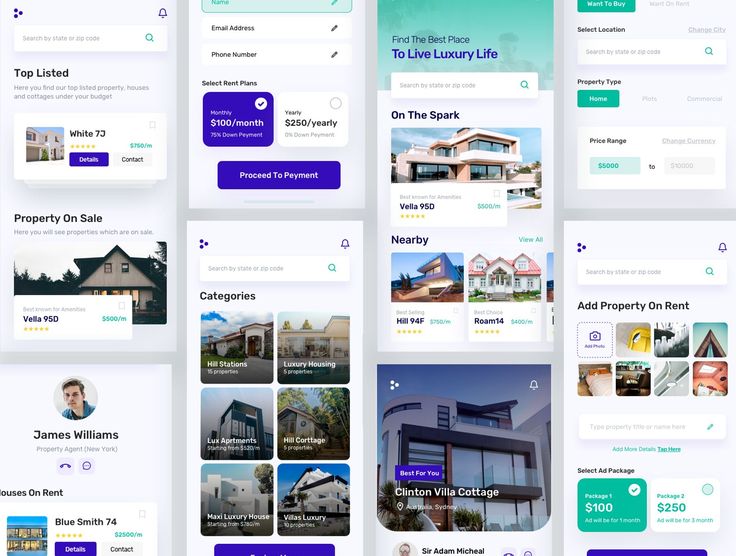
Locate an element on the screen. window is located at coordinates (478, 468), (503, 506), (492, 178), (494, 146), (425, 171).